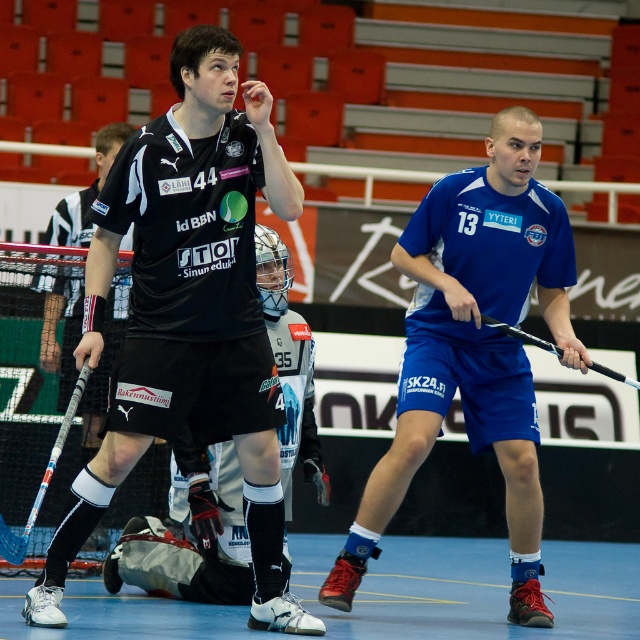
Question: Is black matte jersey at center thinner than blue fabric shorts at center?

Choices:
 (A) no
 (B) yes

Answer: (B)

Question: Among these points, which one is nearest to the camera?

Choices:
 (A) (29, 516)
 (B) (156, 198)

Answer: (B)

Question: Is blue fabric shorts at center wider than white glossy hockey stick at lower left?

Choices:
 (A) yes
 (B) no

Answer: (A)

Question: Does black matte jersey at center have a larger size compared to white glossy hockey stick at lower left?

Choices:
 (A) no
 (B) yes

Answer: (B)

Question: Among these points, which one is farthest from the camera?

Choices:
 (A) (60, 433)
 (B) (353, 552)

Answer: (B)

Question: Which point is closer to the camera?

Choices:
 (A) blue fabric shorts at center
 (B) black glossy hockey stick at right

Answer: (A)